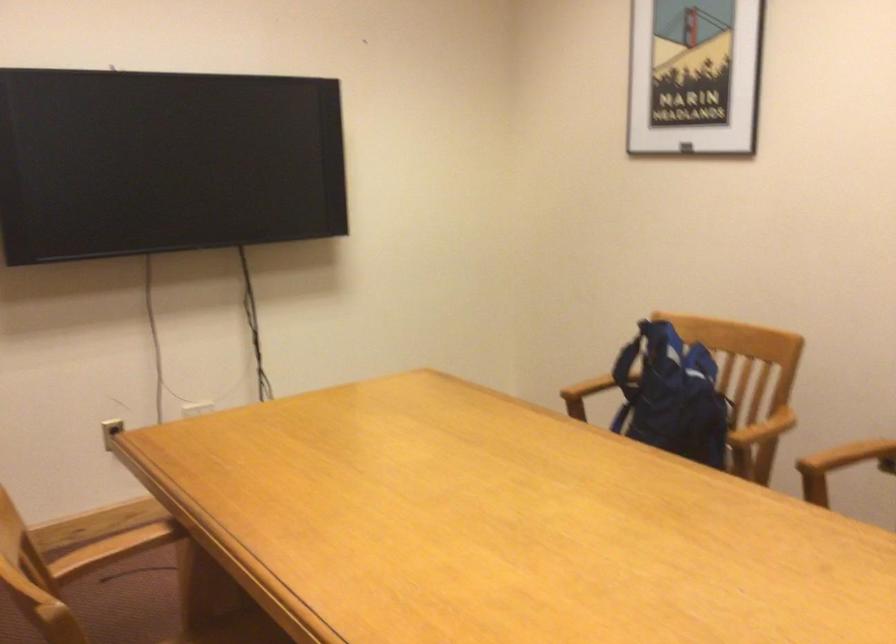
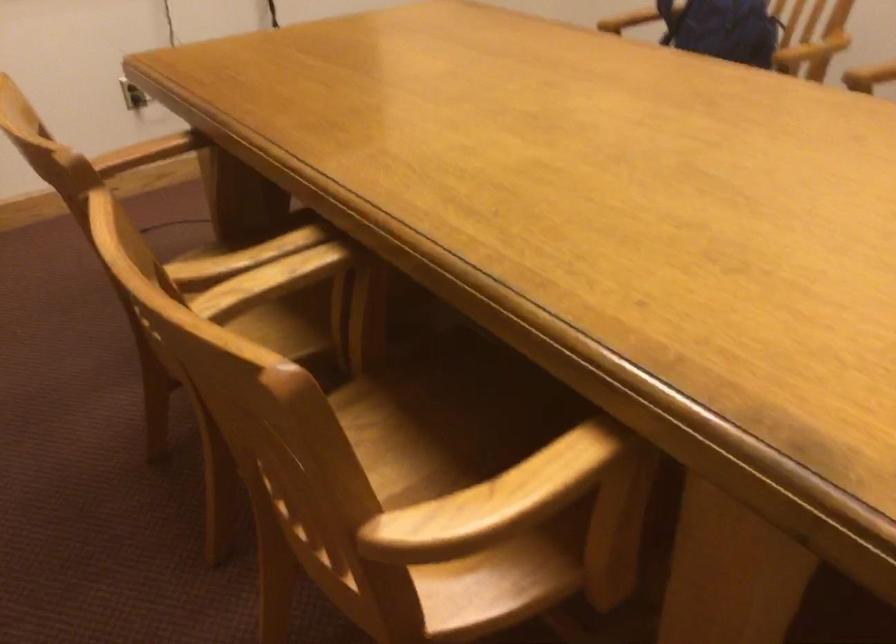
Question: Based on the continuous images, in which direction is the camera rotating? Reply with the corresponding letter.

Choices:
 (A) Left
 (B) Right
 (C) Up
 (D) Down

Answer: (D)